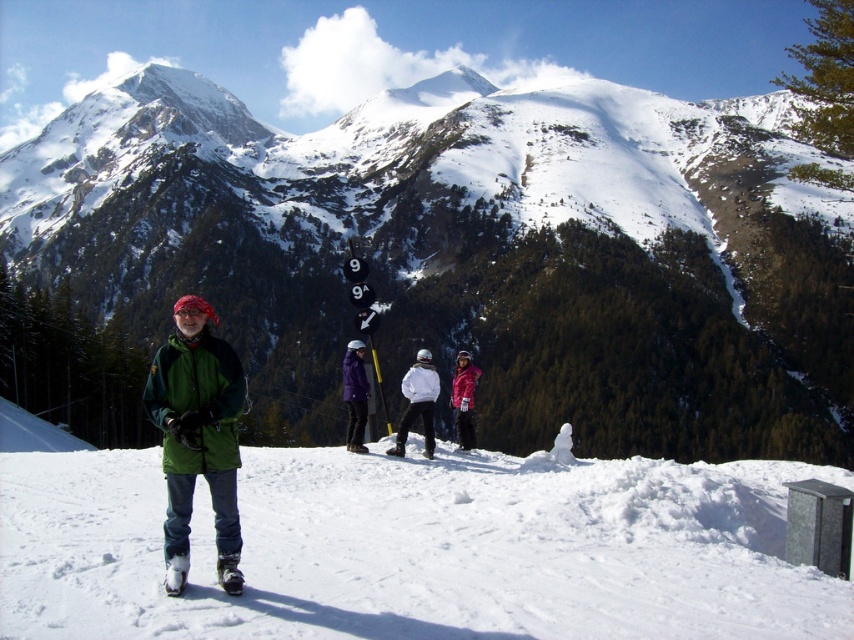
Can you confirm if white snow at center is smaller than green matte jacket at center?

Yes.

Between white snow at center and green matte jacket at center, which one is positioned lower?

Positioned lower is white snow at center.

Does point (534, 632) lie in front of point (197, 356)?

Yes, it is.

Where is `white snow at center`? white snow at center is located at coordinates (408, 545).

Does snowy mountain at center have a greater width compared to purple matte jacket at center?

Correct, the width of snowy mountain at center exceeds that of purple matte jacket at center.

Which is more to the left, snowy mountain at center or purple matte jacket at center?

purple matte jacket at center is more to the left.

Who is more distant from viewer, (457, 317) or (357, 397)?

The point (457, 317) is behind.

Image resolution: width=854 pixels, height=640 pixels. Identify the location of snowy mountain at center. (472, 253).

Who is taller, snowy mountain at center or matte pink snowsuit at center?

Standing taller between the two is snowy mountain at center.

Which is above, snowy mountain at center or matte pink snowsuit at center?

snowy mountain at center is higher up.

Between point (393, 147) and point (472, 433), which one is positioned behind?

Positioned behind is point (393, 147).

Locate an element on the screen. This screenshot has width=854, height=640. snowy mountain at center is located at coordinates (472, 253).